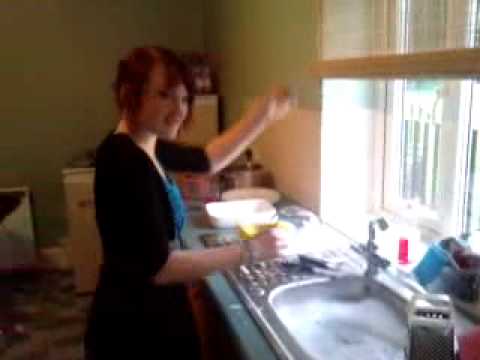
At what (x,y) coordinates should I click in order to perform the action: click on sink basin. Please return your answer as a coordinate pair (x, y). Looking at the image, I should click on (282, 323).